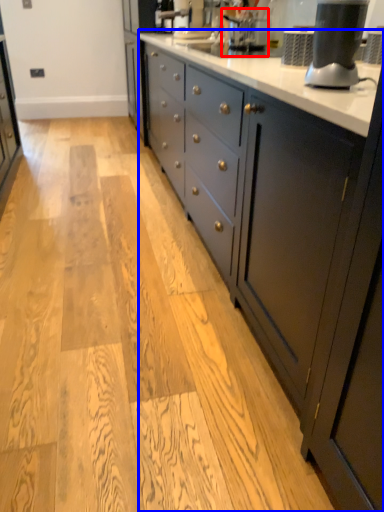
Question: Among these objects, which one is nearest to the camera, coffee machine (highlighted by a red box) or countertop (highlighted by a blue box)?

Choices:
 (A) coffee machine
 (B) countertop

Answer: (B)